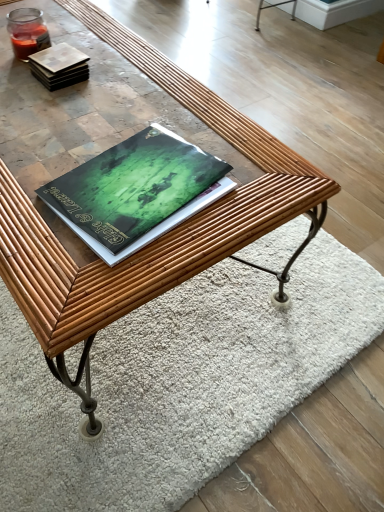
Locate an element on the screen. The image size is (384, 512). vacant space in front of green matte book at center, acting as the second book starting from the back is located at coordinates (102, 278).